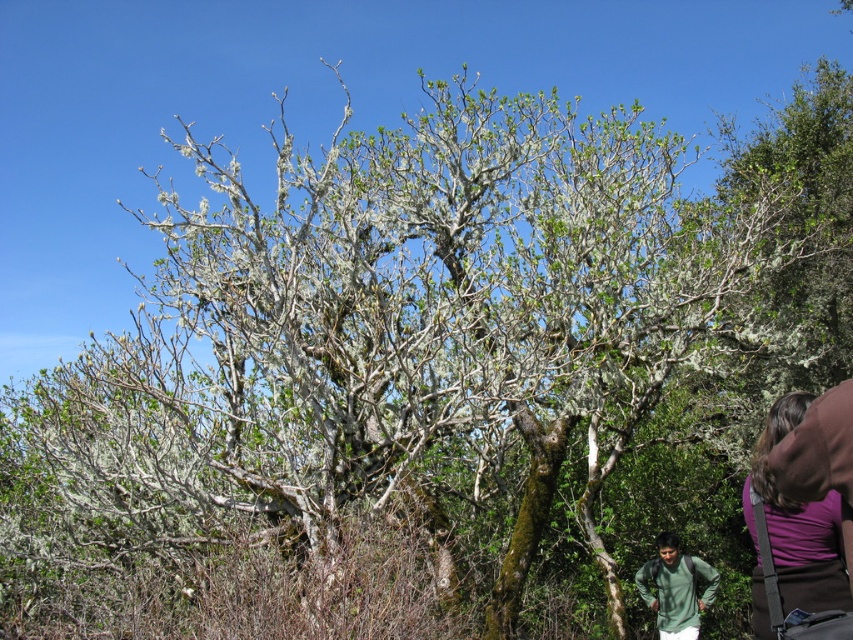
What do you see at coordinates (792, 531) in the screenshot?
I see `purple fabric at lower right` at bounding box center [792, 531].

Which is more to the right, purple fabric at lower right or green matte shirt at lower right?

green matte shirt at lower right is more to the right.

Who is more forward, (764, 614) or (695, 573)?

Point (764, 614) is in front.

What are the coordinates of `purple fabric at lower right` in the screenshot? It's located at (792, 531).